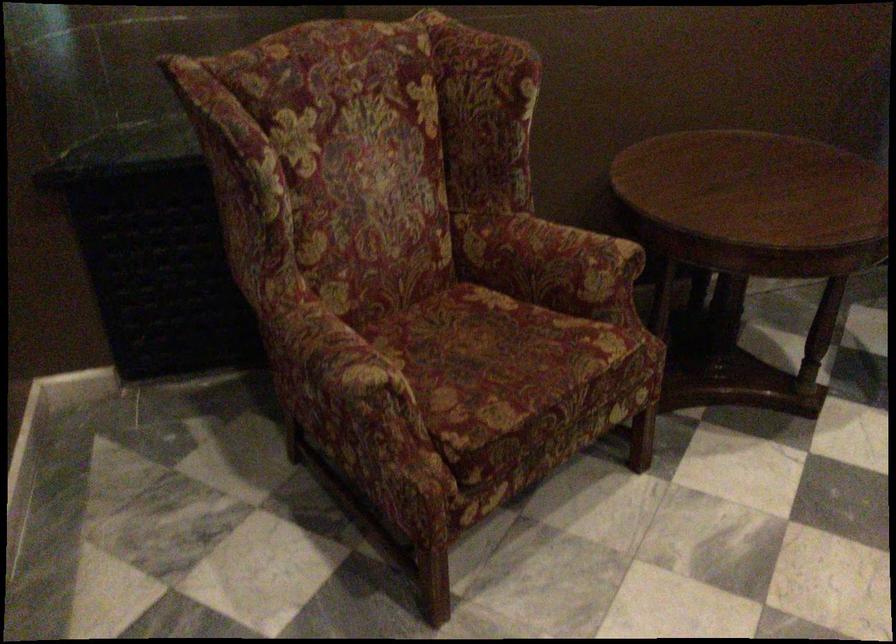
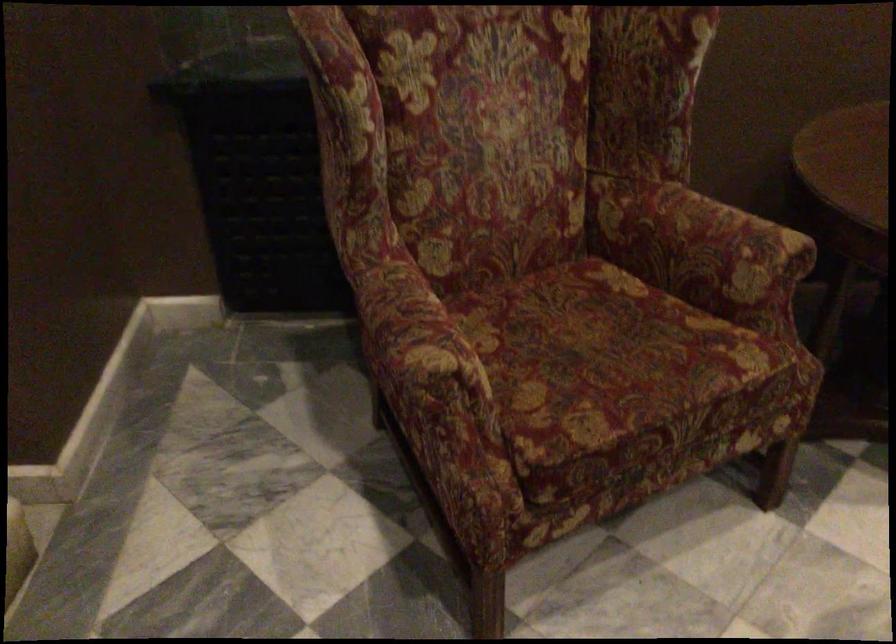
Where in the second image is the point corresponding to [366,388] from the first image?

(428, 377)